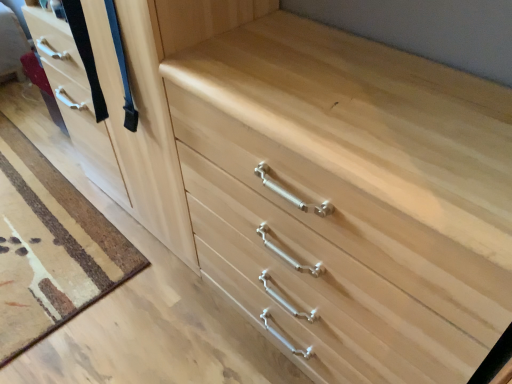
At what (x,y) coordinates should I click in order to perform the action: click on free spot above natural wood drawer at center (from a real-world perspective). Please return your answer as a coordinate pair (x, y). The image size is (512, 384). Looking at the image, I should click on (354, 92).